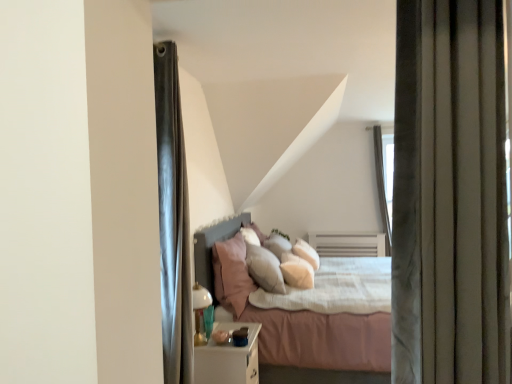
What do you see at coordinates (202, 314) in the screenshot? I see `white glossy lamp at lower left` at bounding box center [202, 314].

The width and height of the screenshot is (512, 384). What do you see at coordinates (231, 275) in the screenshot? I see `pink fabric pillow at center, the first pillow positioned from the left` at bounding box center [231, 275].

Where is `velvet gray curtain at right`? velvet gray curtain at right is located at coordinates (450, 195).

What is the approximate width of white glossy nightstand at lower center?

white glossy nightstand at lower center is 18.23 inches wide.

Describe the element at coordinates (228, 358) in the screenshot. I see `white glossy nightstand at lower center` at that location.

This screenshot has width=512, height=384. What do you see at coordinates (297, 319) in the screenshot?
I see `soft pink fabric bed at center` at bounding box center [297, 319].

Where is `white glossy lamp at lower left`? The height and width of the screenshot is (384, 512). white glossy lamp at lower left is located at coordinates (202, 314).

Is transparent glass door at upper right shorter than white glossy lamp at lower left?

In fact, transparent glass door at upper right may be taller than white glossy lamp at lower left.

Considering the positions of objects transparent glass door at upper right and white glossy lamp at lower left in the image provided, who is in front, transparent glass door at upper right or white glossy lamp at lower left?

white glossy lamp at lower left is in front.

Between point (383, 191) and point (204, 339), which one is positioned behind?

Point (383, 191)

Between transparent glass door at upper right and white glossy lamp at lower left, which one appears on the left side from the viewer's perspective?

white glossy lamp at lower left is more to the left.

Is velvet gray curtain at right looking in the opposite direction of white glossy nightstand at lower center?

velvet gray curtain at right is not turned away from white glossy nightstand at lower center.

Which object is thinner, velvet gray curtain at right or white glossy nightstand at lower center?

With smaller width is velvet gray curtain at right.

Between velvet gray curtain at right and white glossy nightstand at lower center, which one is positioned behind?

white glossy nightstand at lower center is further away from the camera.

How much distance is there between velvet gray curtain at right and white glossy nightstand at lower center?

velvet gray curtain at right is 1.86 meters away from white glossy nightstand at lower center.

Which of these two, velvet gray curtain at right or soft white pillow at center, arranged as the 2th pillow when viewed from the left, is thinner?

velvet gray curtain at right.

Looking at this image, does velvet gray curtain at right touch soft white pillow at center, the first pillow positioned from the right?

velvet gray curtain at right is not next to soft white pillow at center, the first pillow positioned from the right, and they're not touching.

Looking at this image, between velvet gray curtain at right and soft white pillow at center, arranged as the 2th pillow when viewed from the left, which one has less height?

soft white pillow at center, arranged as the 2th pillow when viewed from the left.

Is the position of soft white pillow at center, arranged as the 2th pillow when viewed from the left, less distant than that of transparent glass door at upper right?

Yes, soft white pillow at center, arranged as the 2th pillow when viewed from the left, is closer to the viewer.

In terms of size, does soft white pillow at center, arranged as the 2th pillow when viewed from the left, appear bigger or smaller than transparent glass door at upper right?

soft white pillow at center, arranged as the 2th pillow when viewed from the left, is smaller than transparent glass door at upper right.

Measure the distance between soft white pillow at center, the first pillow positioned from the right, and transparent glass door at upper right.

A distance of 7.59 feet exists between soft white pillow at center, the first pillow positioned from the right, and transparent glass door at upper right.

From the image's perspective, between pink fabric pillow at center, the 2th pillow when ordered from right to left, and soft white pillow at center, arranged as the 2th pillow when viewed from the left, who is located below?

soft white pillow at center, arranged as the 2th pillow when viewed from the left, appears lower in the image.

Considering the sizes of objects pink fabric pillow at center, the first pillow positioned from the left, and soft white pillow at center, the first pillow positioned from the right, in the image provided, who is taller, pink fabric pillow at center, the first pillow positioned from the left, or soft white pillow at center, the first pillow positioned from the right,?

With more height is soft white pillow at center, the first pillow positioned from the right.

Between pink fabric pillow at center, the 2th pillow when ordered from right to left, and soft white pillow at center, arranged as the 2th pillow when viewed from the left, which one has larger width?

Wider between the two is soft white pillow at center, arranged as the 2th pillow when viewed from the left.

From a real-world perspective, who is located lower, pink fabric pillow at center, the first pillow positioned from the left, or soft white pillow at center, the first pillow positioned from the right?

soft white pillow at center, the first pillow positioned from the right.

Considering the sizes of objects soft pink fabric bed at center and transparent glass door at upper right in the image provided, who is wider, soft pink fabric bed at center or transparent glass door at upper right?

With larger width is soft pink fabric bed at center.

Is soft pink fabric bed at center taller or shorter than transparent glass door at upper right?

In the image, soft pink fabric bed at center appears to be shorter than transparent glass door at upper right.

From the image's perspective, between soft pink fabric bed at center and transparent glass door at upper right, which one is located above?

transparent glass door at upper right.

Which object is more forward, soft pink fabric bed at center or transparent glass door at upper right?

soft pink fabric bed at center is closer to the camera.

Considering the sizes of objects white glossy lamp at lower left and transparent glass door at upper right in the image provided, who is shorter, white glossy lamp at lower left or transparent glass door at upper right?

white glossy lamp at lower left.

Considering the sizes of objects white glossy lamp at lower left and transparent glass door at upper right in the image provided, who is wider, white glossy lamp at lower left or transparent glass door at upper right?

transparent glass door at upper right.

Would you say white glossy lamp at lower left is inside or outside transparent glass door at upper right?

white glossy lamp at lower left is located beyond the bounds of transparent glass door at upper right.

This screenshot has width=512, height=384. In order to click on glass door behind the white glossy lamp at lower left in this screenshot , I will do `click(382, 187)`.

You are a GUI agent. You are given a task and a screenshot of the screen. Output one action in this format:
    pyautogui.click(x=<x>, y=<y>)
    Task: Click on the curtain in front of the white glossy nightstand at lower center
    
    Given the screenshot: What is the action you would take?
    pyautogui.click(x=450, y=195)

Looking at the image, which one is located closer to white glossy nightstand at lower center, soft pink fabric bed at center or pink fabric pillow at center, the first pillow positioned from the left?

pink fabric pillow at center, the first pillow positioned from the left, is closer to white glossy nightstand at lower center.

Considering their positions, is white glossy lamp at lower left positioned further to velvet gray curtain at right than soft pink fabric bed at center?

soft pink fabric bed at center.

Which object lies nearer to the anchor point soft pink fabric bed at center, soft white pillow at center, the first pillow positioned from the right, or white glossy nightstand at lower center?

white glossy nightstand at lower center.

Looking at the image, which one is located closer to soft pink fabric bed at center, white glossy nightstand at lower center or soft white pillow at center, arranged as the 2th pillow when viewed from the left?

white glossy nightstand at lower center is closer to soft pink fabric bed at center.

Looking at the image, which one is located further to white glossy nightstand at lower center, transparent glass door at upper right or velvet gray curtain at right?

transparent glass door at upper right is positioned further to the anchor white glossy nightstand at lower center.

From the image, which object appears to be nearer to white glossy lamp at lower left, pink fabric pillow at center, the first pillow positioned from the left, or transparent glass door at upper right?

Among the two, pink fabric pillow at center, the first pillow positioned from the left, is located nearer to white glossy lamp at lower left.

Estimate the real-world distances between objects in this image. Which object is further from white glossy lamp at lower left, white glossy nightstand at lower center or soft pink fabric bed at center?

soft pink fabric bed at center is further to white glossy lamp at lower left.

Looking at the image, which one is located closer to white glossy nightstand at lower center, velvet gray curtain at right or white glossy lamp at lower left?

The object closer to white glossy nightstand at lower center is white glossy lamp at lower left.

Where is `nightstand located between velvet gray curtain at right and soft pink fabric bed at center in the depth direction`? nightstand located between velvet gray curtain at right and soft pink fabric bed at center in the depth direction is located at coordinates (228, 358).

Locate an element on the screen. lamp located between white glossy nightstand at lower center and soft white pillow at center, the first pillow positioned from the right, in the depth direction is located at coordinates (202, 314).

Locate an element on the screen. This screenshot has width=512, height=384. pillow between velvet gray curtain at right and soft white pillow at center, arranged as the 2th pillow when viewed from the left, along the z-axis is located at coordinates (231, 275).

At what (x,y) coordinates should I click in order to perform the action: click on bed between white glossy nightstand at lower center and soft white pillow at center, the first pillow positioned from the right, from front to back. Please return your answer as a coordinate pair (x, y). Looking at the image, I should click on (297, 319).